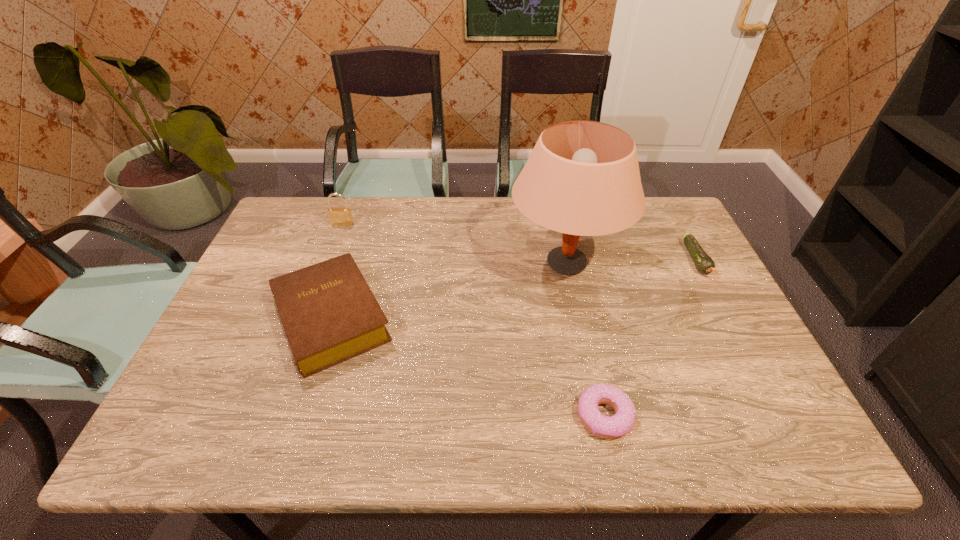
Identify the location of vacant space at the far edge of the desktop. (416, 217).

I want to click on vacant space at the left edge of the desktop, so click(266, 346).

In the image, there is a desktop. Where is `vacant area at the right edge`? This screenshot has height=540, width=960. vacant area at the right edge is located at coordinates [677, 255].

Where is `free location at the far left corner of the desktop`? free location at the far left corner of the desktop is located at coordinates (301, 226).

Where is `vacant area at the near right corner`? vacant area at the near right corner is located at coordinates (794, 443).

I want to click on vacant space that is in between the zucchini and the lampshade, so click(x=631, y=261).

I want to click on free space between the Bible and the tallest object, so [448, 291].

Where is `vacant region between the farthest object and the rightmost object`? The height and width of the screenshot is (540, 960). vacant region between the farthest object and the rightmost object is located at coordinates (519, 242).

Locate an element on the screen. Image resolution: width=960 pixels, height=540 pixels. free space between the nearest object and the padlock is located at coordinates (473, 320).

Identify the location of free space that is in between the doughnut and the padlock. (473, 320).